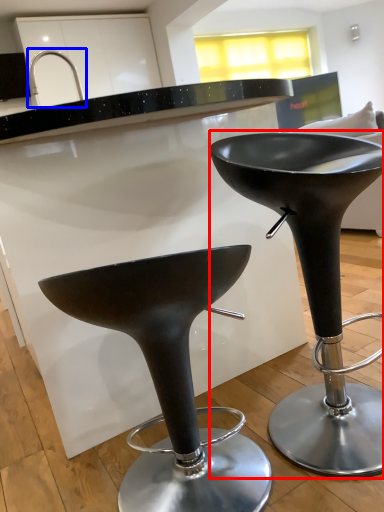
Question: Among these objects, which one is nearest to the camera, stool (highlighted by a red box) or faucet (highlighted by a blue box)?

Choices:
 (A) stool
 (B) faucet

Answer: (A)